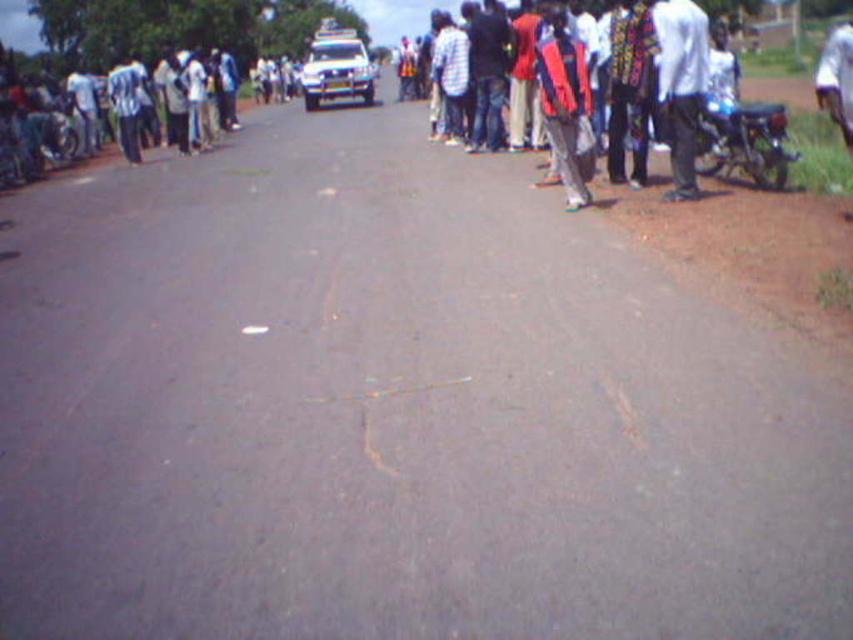
Is red fabric crowd at center below metallic blue motorcycle at right?

No.

Who is taller, red fabric crowd at center or metallic blue motorcycle at right?

With more height is red fabric crowd at center.

Find the location of a particular element. This screenshot has width=853, height=640. red fabric crowd at center is located at coordinates (680, 84).

Where is `red fabric crowd at center`? red fabric crowd at center is located at coordinates (680, 84).

Is jeans at center taller than white glossy car at center?

No.

Who is taller, jeans at center or white glossy car at center?

white glossy car at center is taller.

You are a GUI agent. You are given a task and a screenshot of the screen. Output one action in this format:
    pyautogui.click(x=<x>, y=<y>)
    Task: Click on the jeans at center
    The height and width of the screenshot is (640, 853).
    Given the screenshot: What is the action you would take?
    pyautogui.click(x=486, y=74)

The width and height of the screenshot is (853, 640). I want to click on jeans at center, so click(x=486, y=74).

Is red fabric crowd at center below white glossy car at center?

Yes, red fabric crowd at center is below white glossy car at center.

Between point (677, 196) and point (332, 28), which one is positioned in front?

Positioned in front is point (677, 196).

Identify the location of red fabric crowd at center. The width and height of the screenshot is (853, 640). (680, 84).

I want to click on red fabric crowd at center, so click(680, 84).